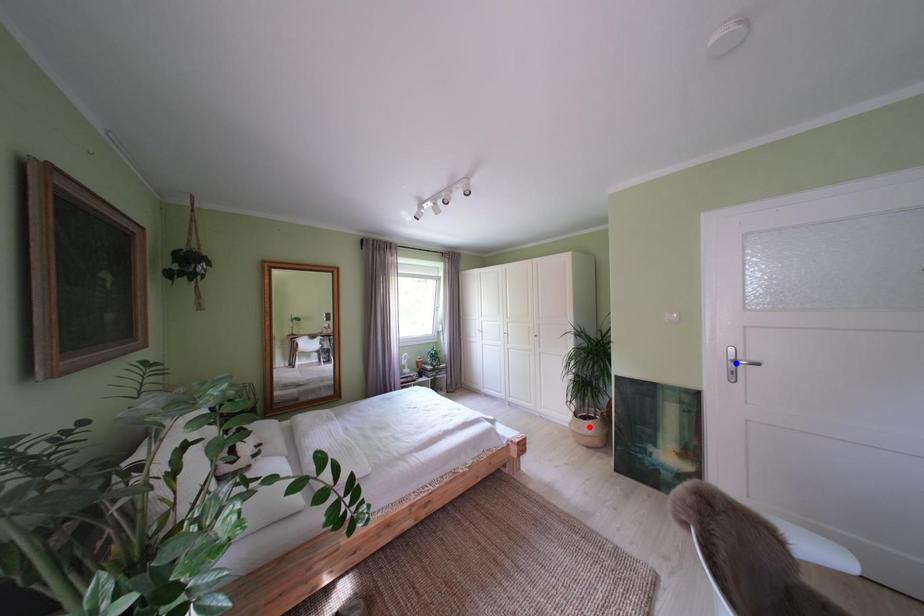
Question: Which of the two points in the image is closer to the camera?

Choices:
 (A) Blue point is closer.
 (B) Red point is closer.

Answer: (A)